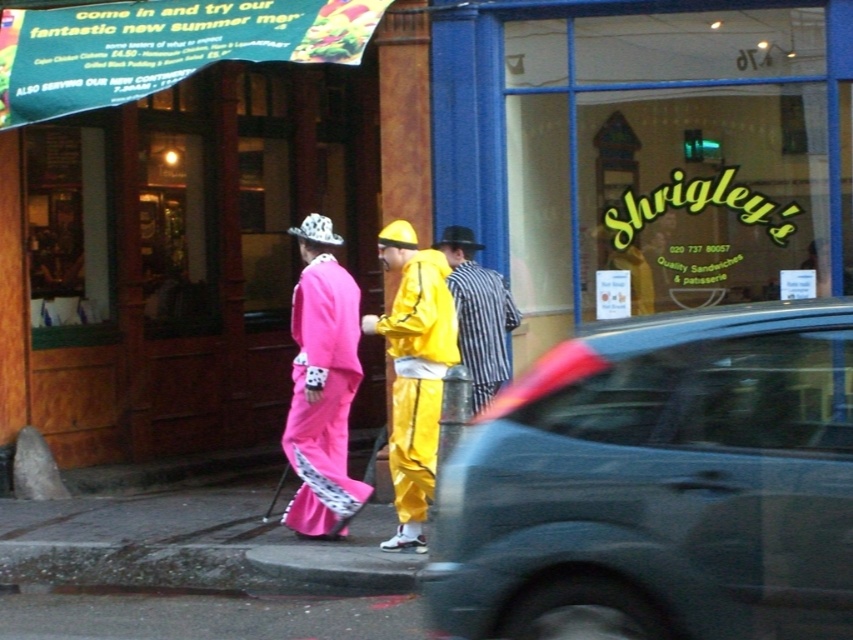
Which is more to the right, matte yellow jumpsuit at center or pink satin kimono at center?

matte yellow jumpsuit at center

Is point (399, 394) more distant than point (289, 452)?

No, it is in front of (289, 452).

Does point (415, 292) come farther from viewer compared to point (309, 465)?

That is False.

You are a GUI agent. You are given a task and a screenshot of the screen. Output one action in this format:
    pyautogui.click(x=<x>, y=<y>)
    Task: Click on the matte yellow jumpsuit at center
    The image size is (853, 640).
    Given the screenshot: What is the action you would take?
    pyautogui.click(x=415, y=371)

Is point (312, 292) more distant than point (496, 353)?

That is False.

Does pink satin kimono at center lie behind striped fabric shirt at center?

No.

This screenshot has width=853, height=640. What do you see at coordinates (322, 387) in the screenshot?
I see `pink satin kimono at center` at bounding box center [322, 387].

Where is `pink satin kimono at center`? The width and height of the screenshot is (853, 640). pink satin kimono at center is located at coordinates (322, 387).

Can you confirm if matte yellow jumpsuit at center is positioned to the left of striped fabric shirt at center?

Indeed, matte yellow jumpsuit at center is positioned on the left side of striped fabric shirt at center.

Does matte yellow jumpsuit at center have a smaller size compared to striped fabric shirt at center?

No, matte yellow jumpsuit at center is not smaller than striped fabric shirt at center.

Who is more forward, (421, 333) or (490, 372)?

Point (421, 333) is more forward.

Find the location of a particular element. matte yellow jumpsuit at center is located at coordinates (415, 371).